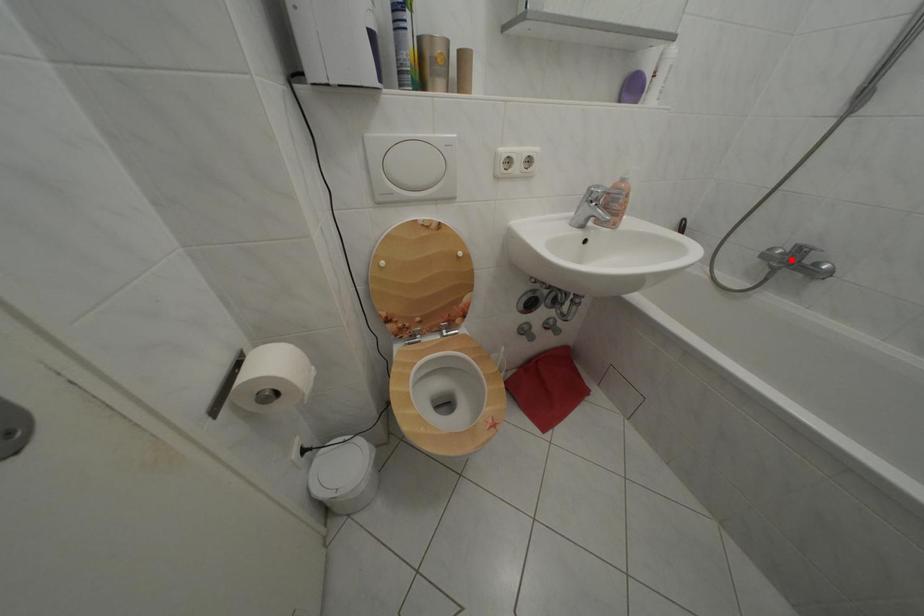
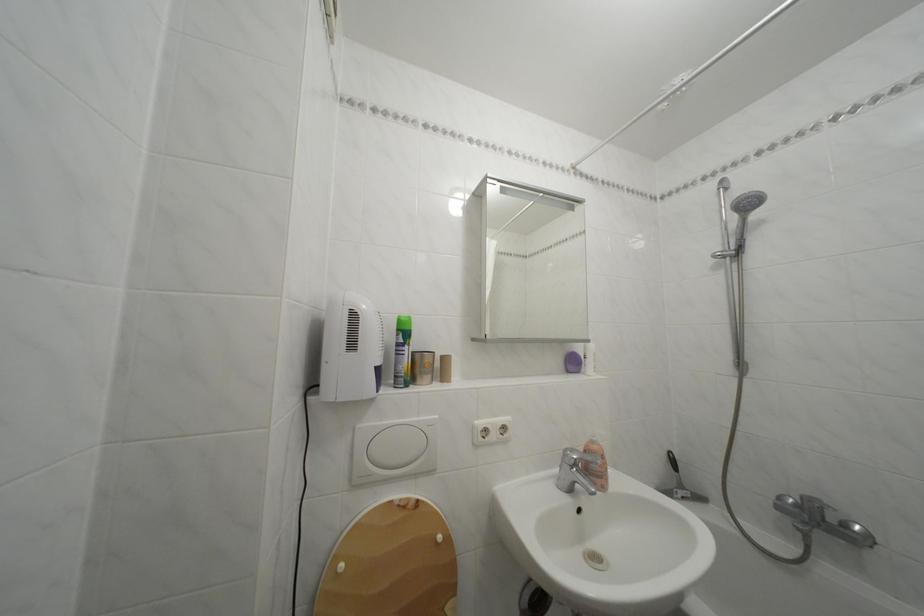
In the second image, find the point that corresponds to the highlighted location in the first image.

(806, 512)